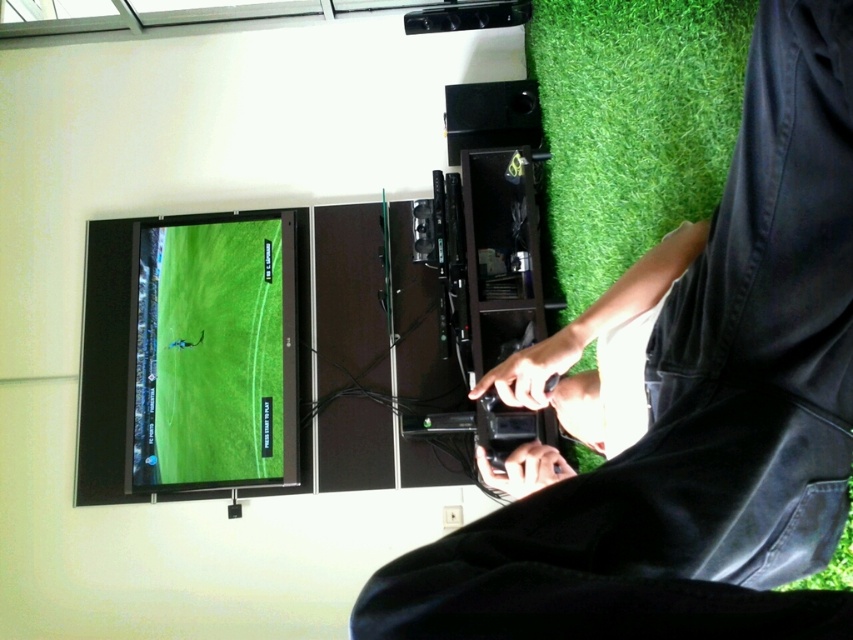
Who is more forward, (x=550, y=500) or (x=642, y=289)?

Point (x=550, y=500) is in front.

Which is behind, point (817, 557) or point (561, 339)?

Positioned behind is point (561, 339).

Locate an element on the screen. The width and height of the screenshot is (853, 640). black matte pants at lower right is located at coordinates (685, 406).

Which is more to the left, green matte screen at left or black matte controller at lower center?

green matte screen at left is more to the left.

Who is shorter, green matte screen at left or black matte controller at lower center?

Standing shorter between the two is black matte controller at lower center.

This screenshot has width=853, height=640. I want to click on green matte screen at left, so click(x=213, y=355).

Locate an element on the screen. This screenshot has width=853, height=640. green matte screen at left is located at coordinates (213, 355).

In the scene shown: Does black matte pants at lower right appear under green matte screen at left?

Actually, black matte pants at lower right is above green matte screen at left.

Is point (805, 547) positioned after point (175, 461)?

No, (805, 547) is closer to viewer.

You are a GUI agent. You are given a task and a screenshot of the screen. Output one action in this format:
    pyautogui.click(x=<x>, y=<y>)
    Task: Click on the black matte pants at lower right
    Image resolution: width=853 pixels, height=640 pixels.
    Given the screenshot: What is the action you would take?
    pyautogui.click(x=685, y=406)